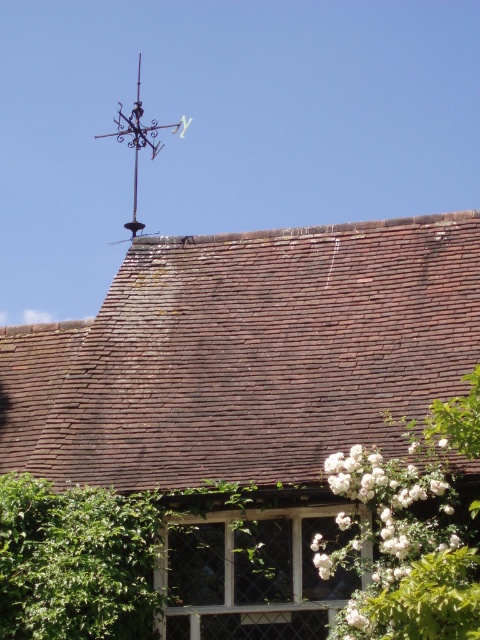
Does green leafy hedge at lower left appear over black wrought iron vane at upper left?

No, green leafy hedge at lower left is not above black wrought iron vane at upper left.

Does green leafy hedge at lower left have a lesser height compared to black wrought iron vane at upper left?

Correct, green leafy hedge at lower left is not as tall as black wrought iron vane at upper left.

Based on the photo, who is more forward, [108,532] or [159,140]?

Positioned in front is point [108,532].

Locate an element on the screen. green leafy hedge at lower left is located at coordinates (75, 561).

Which is behind, point (168, 333) or point (118, 634)?

Point (168, 333)

Is the position of brown tile roof at upper center less distant than that of green leafy hedge at lower left?

No, it is behind green leafy hedge at lower left.

Which is in front, point (100, 445) or point (123, 602)?

Positioned in front is point (123, 602).

The height and width of the screenshot is (640, 480). Identify the location of brown tile roof at upper center. (245, 355).

Can you confirm if brown tile roof at upper center is bigger than black wrought iron vane at upper left?

No.

Who is more forward, (420, 225) or (139, 106)?

Point (420, 225)

Identify the location of brown tile roof at upper center. This screenshot has height=640, width=480. (245, 355).